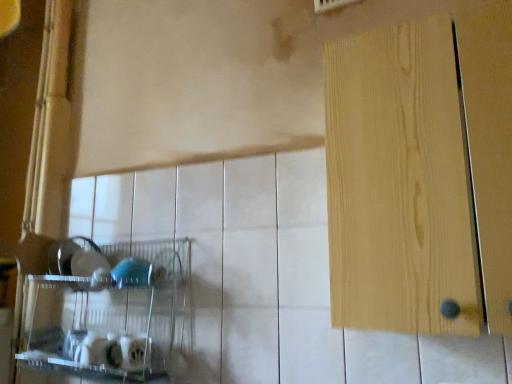
Question: Is clear plastic shelf at lower left behind light wood door at right?

Choices:
 (A) no
 (B) yes

Answer: (B)

Question: Is clear plastic shelf at lower left next to light wood door at right?

Choices:
 (A) yes
 (B) no

Answer: (B)

Question: Considering the relative positions of clear plastic shelf at lower left and light wood door at right in the image provided, is clear plastic shelf at lower left in front of light wood door at right?

Choices:
 (A) yes
 (B) no

Answer: (B)

Question: Is clear plastic shelf at lower left oriented away from light wood door at right?

Choices:
 (A) yes
 (B) no

Answer: (B)

Question: Considering the relative sizes of clear plastic shelf at lower left and light wood door at right in the image provided, is clear plastic shelf at lower left smaller than light wood door at right?

Choices:
 (A) yes
 (B) no

Answer: (A)

Question: Is clear plastic shelf at lower left not near light wood door at right?

Choices:
 (A) yes
 (B) no

Answer: (B)

Question: Is light wood door at right oriented away from clear plastic shelf at lower left?

Choices:
 (A) yes
 (B) no

Answer: (B)

Question: Can you confirm if light wood door at right is thinner than clear plastic shelf at lower left?

Choices:
 (A) no
 (B) yes

Answer: (A)

Question: Is light wood door at right bigger than clear plastic shelf at lower left?

Choices:
 (A) yes
 (B) no

Answer: (A)

Question: Is light wood door at right smaller than clear plastic shelf at lower left?

Choices:
 (A) no
 (B) yes

Answer: (A)

Question: Is clear plastic shelf at lower left inside light wood door at right?

Choices:
 (A) no
 (B) yes

Answer: (A)

Question: Considering the relative sizes of light wood door at right and clear plastic shelf at lower left in the image provided, is light wood door at right wider than clear plastic shelf at lower left?

Choices:
 (A) yes
 (B) no

Answer: (A)

Question: From a real-world perspective, is clear plastic shelf at lower left physically located above or below light wood door at right?

Choices:
 (A) below
 (B) above

Answer: (A)